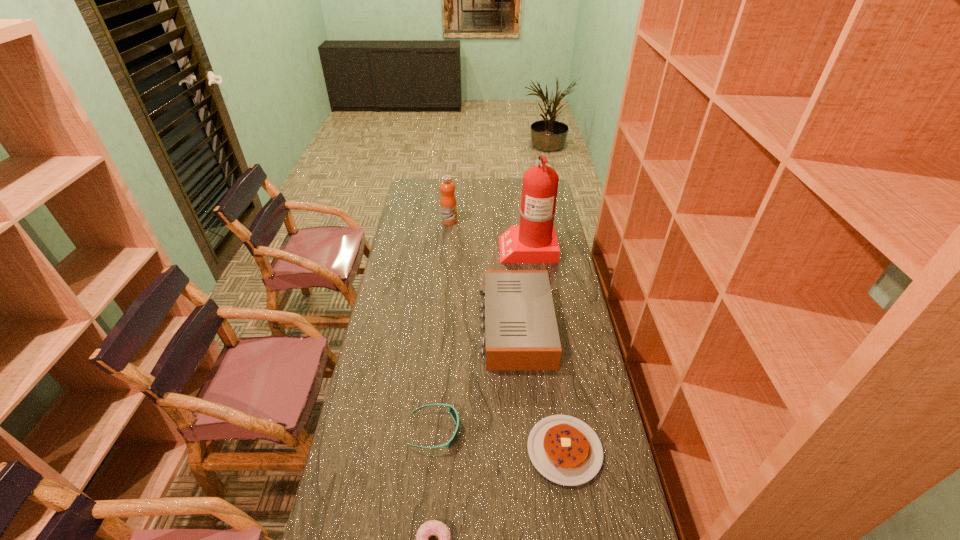
Find the location of `the tallest object`. the tallest object is located at coordinates (533, 241).

In order to click on the second farthest object in this screenshot , I will do `click(533, 241)`.

You are a GUI agent. You are given a task and a screenshot of the screen. Output one action in this format:
    pyautogui.click(x=<x>, y=<y>)
    Task: Click on the second tallest object
    Image resolution: width=960 pixels, height=540 pixels.
    Given the screenshot: What is the action you would take?
    448,205

Locate an element on the screen. the farthest object is located at coordinates (448, 205).

At what (x,y) coordinates should I click in order to perform the action: click on radio receiver. Please return your answer as a coordinate pair (x, y). Looking at the image, I should click on (521, 333).

This screenshot has width=960, height=540. In order to click on the fourth shortest object in this screenshot , I will do `click(521, 333)`.

The image size is (960, 540). I want to click on sunglasses, so click(452, 410).

I want to click on pancake, so click(x=564, y=449).

Where is `vacant region located 0.300m on the front-facing side of the second farthest object`? The image size is (960, 540). vacant region located 0.300m on the front-facing side of the second farthest object is located at coordinates (434, 247).

Find the location of a particular element. This screenshot has width=960, height=540. vacant region located on the front-facing side of the second farthest object is located at coordinates (434, 247).